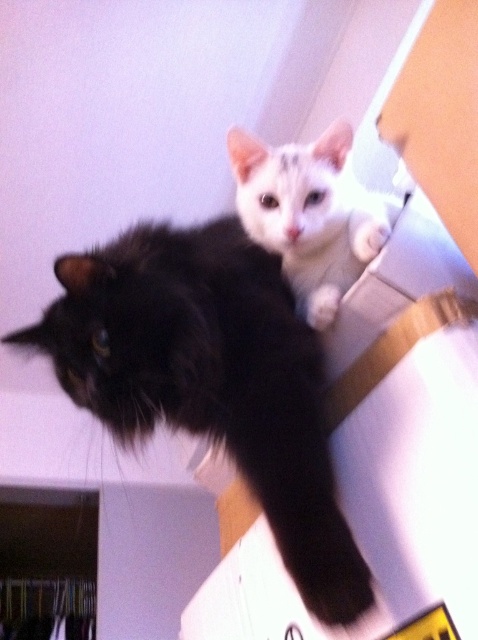
Question: Which of these objects is positioned farthest from the white soft fur cat at upper center?

Choices:
 (A) white fur at upper center
 (B) white fur paw at upper center

Answer: (A)

Question: Which of these objects is positioned closest to the white fur at upper center?

Choices:
 (A) white fur paw at upper center
 (B) black fluffy cat at upper center

Answer: (A)

Question: Does white fur paw at upper center have a greater width compared to white fur at upper center?

Choices:
 (A) yes
 (B) no

Answer: (B)

Question: Is white soft fur cat at upper center below white fur at upper center?

Choices:
 (A) yes
 (B) no

Answer: (B)

Question: Among these points, which one is nearest to the camera?

Choices:
 (A) (334, 289)
 (B) (80, 330)
 (C) (250, 186)

Answer: (B)

Question: Observing the image, what is the correct spatial positioning of white fur paw at upper center in reference to white fur at upper center?

Choices:
 (A) right
 (B) left

Answer: (A)